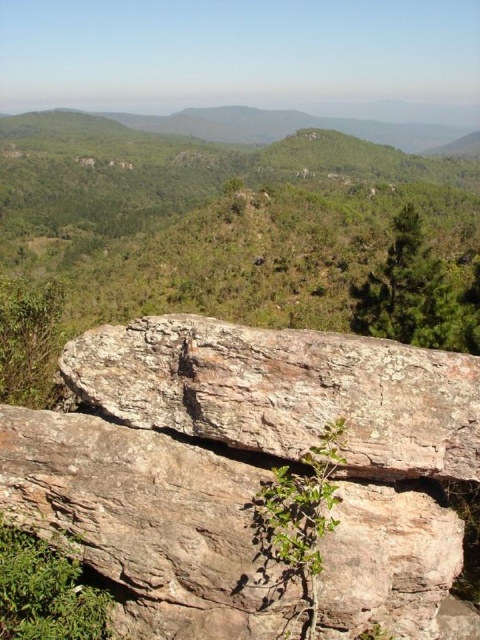
You are a hiker who wants to take a photo of the rusty brown rock at center and the green textured tree at upper right in the same frame. Based on their positions, will you need to adjust your camera angle upwards or downwards to include both in the shot?

The rusty brown rock at center is located below the green textured tree at upper right, so you will need to adjust your camera angle upwards to include both in the shot.